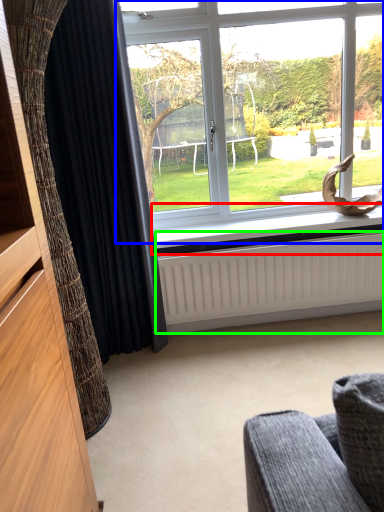
Question: Which object is the closest to the window sill (highlighted by a red box)? Choose among these: window (highlighted by a blue box) or radiator (highlighted by a green box).

Choices:
 (A) window
 (B) radiator

Answer: (B)